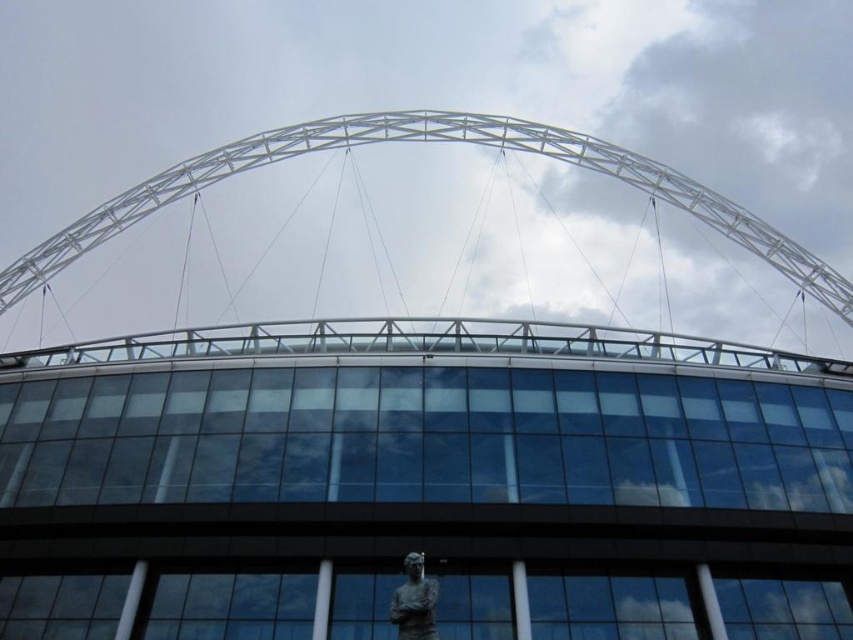
Between point (239, 156) and point (422, 586), which one is positioned behind?

The point (239, 156) is behind.

Can you confirm if white metallic arch at center is taller than bronze statue at lower center?

Yes.

Is point (660, 168) closer to camera compared to point (399, 637)?

No, it is not.

Where is `white metallic arch at center`? This screenshot has width=853, height=640. white metallic arch at center is located at coordinates (426, 141).